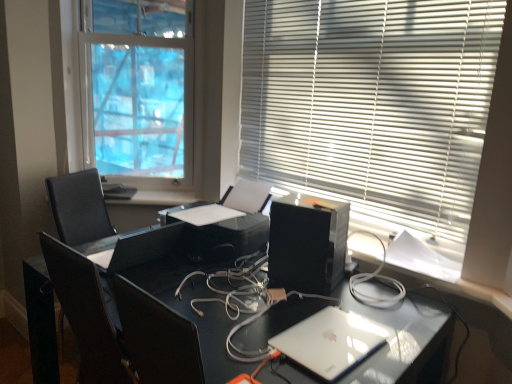
Find the location of a particular element. vacant space in between satin white laptop at lower right and black plastic desktop computer at center is located at coordinates (309, 303).